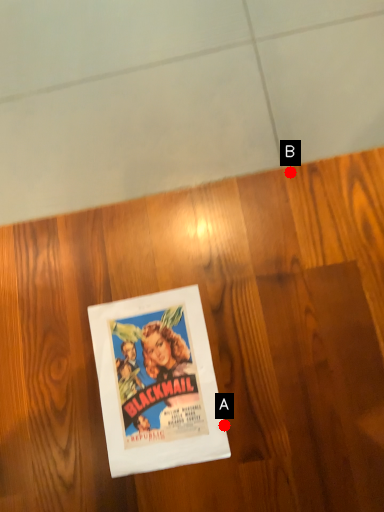
Question: Two points are circled on the image, labeled by A and B beside each circle. Which point appears closest to the camera in this image?

Choices:
 (A) A is closer
 (B) B is closer

Answer: (A)